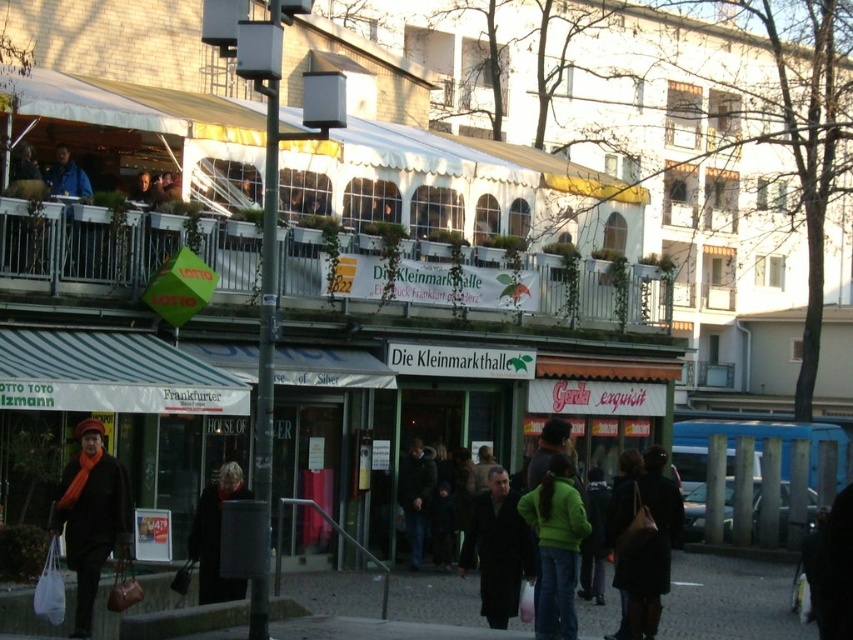
Question: Does matte black coat at lower left have a greater width compared to green matte jacket at center?

Choices:
 (A) yes
 (B) no

Answer: (A)

Question: Among these points, which one is nearest to the camera?

Choices:
 (A) pos(636,580)
 (B) pos(96,349)
 (C) pos(474,515)
 (D) pos(54,193)

Answer: (A)

Question: Which point appears farthest from the camera in this image?

Choices:
 (A) (778, 605)
 (B) (204, 596)
 (C) (508, 522)
 (D) (659, 496)

Answer: (A)

Question: Can you confirm if dark brown coat at center is positioned below blue jacket at upper left?

Choices:
 (A) yes
 (B) no

Answer: (A)

Question: Considering the real-world distances, which object is closest to the blue jacket at upper left?

Choices:
 (A) dark green jacket at center
 (B) dark gray asphalt at lower center

Answer: (A)

Question: Where is matte white awning at center located in relation to black leather coat at lower center in the image?

Choices:
 (A) above
 (B) below

Answer: (A)